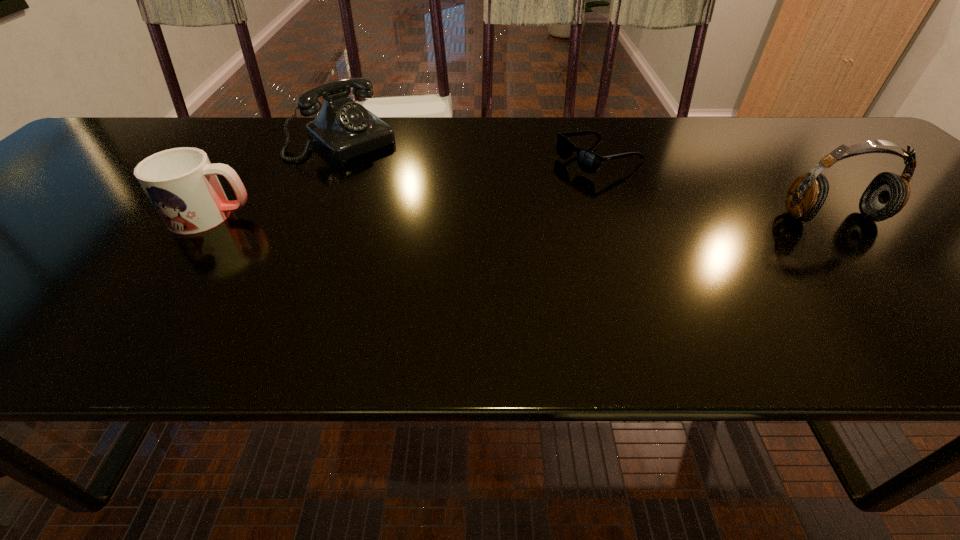
The width and height of the screenshot is (960, 540). Identify the location of the closest object to the shortest object. (886, 195).

Select which object is the second closest to the telephone. Please provide its 2D coordinates. Your answer should be formatted as a tuple, i.e. [(x, y)], where the tuple contains the x and y coordinates of a point satisfying the conditions above.

[(588, 161)]

Locate an element on the screen. This screenshot has height=540, width=960. vacant point that satisfies the following two spatial constraints: 1. on the front side of the sunglasses; 2. on the left side of the telephone is located at coordinates (335, 158).